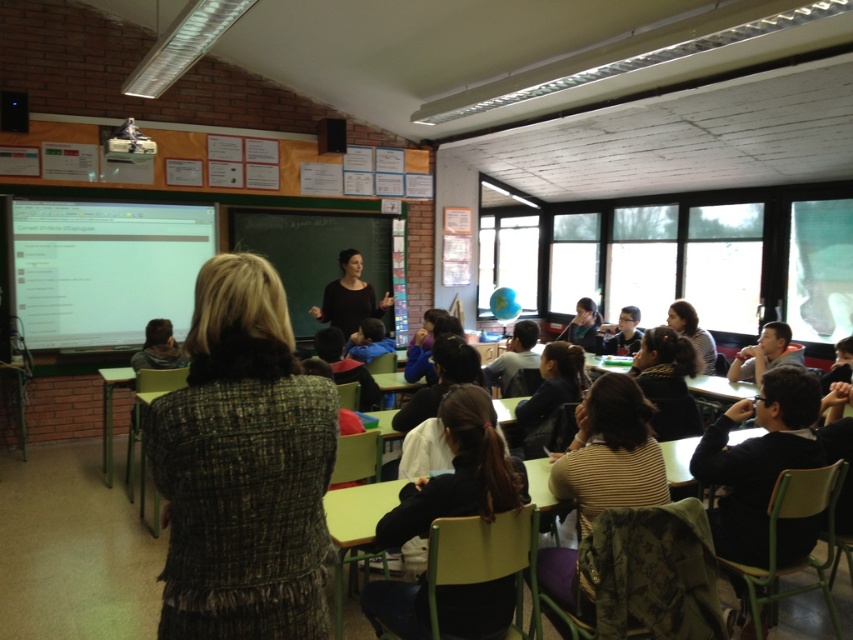
Based on the photo, you are a student sitting in the classroom and want to determine the relative positions of two points marked in the image. Which point is closer to you, point (281,234) or point (335,282)?

Point (281,234) is further to the viewer than point (335,282), so point (335,282) is closer to you.